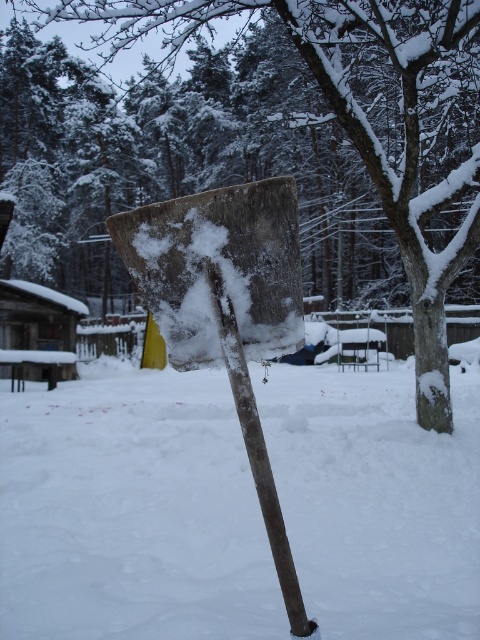
Who is more distant from viewer, (228, 602) or (298, 253)?

The point (228, 602) is behind.

Where is `white fluffy snow at center`? The width and height of the screenshot is (480, 640). white fluffy snow at center is located at coordinates pos(131,509).

Measure the distance between snow-covered wood at center and snow-covered wood shovel at center.

62.09 feet

Does snow-covered wood at center have a greater width compared to snow-covered wood shovel at center?

Correct, the width of snow-covered wood at center exceeds that of snow-covered wood shovel at center.

The height and width of the screenshot is (640, 480). What do you see at coordinates (350, 131) in the screenshot?
I see `snow-covered wood at center` at bounding box center [350, 131].

You are a GUI agent. You are given a task and a screenshot of the screen. Output one action in this format:
    pyautogui.click(x=<x>, y=<y>)
    Task: Click on the snow-covered wood at center
    This screenshot has height=640, width=480.
    Given the screenshot: What is the action you would take?
    pyautogui.click(x=350, y=131)

Does white fluffy snow at center have a greater height compared to snow-covered wood at center?

Incorrect, white fluffy snow at center's height is not larger of snow-covered wood at center's.

Is point (387, 465) positioned in front of point (323, 257)?

Yes, it is.

Locate an element on the screen. white fluffy snow at center is located at coordinates (131, 509).